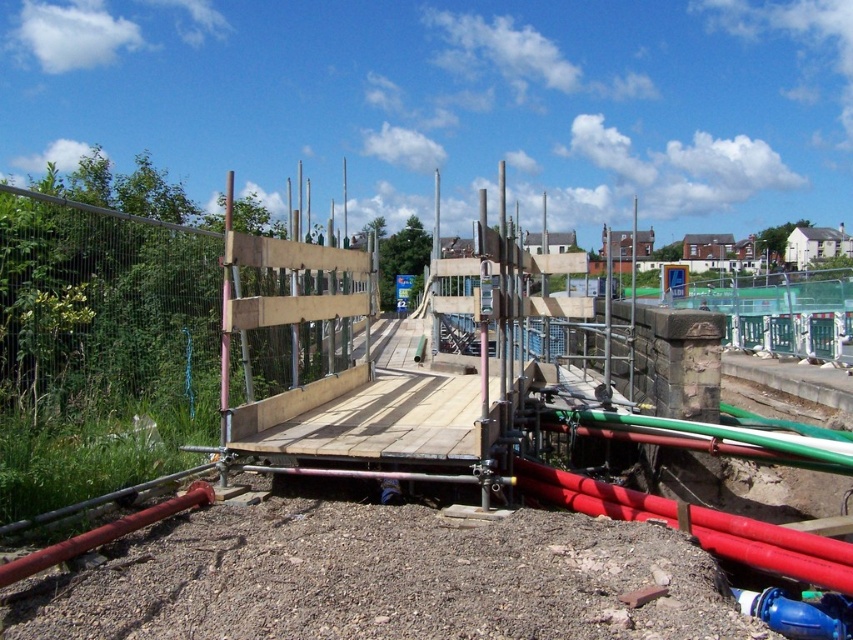
Question: Among these points, which one is farthest from the camera?

Choices:
 (A) (239, 426)
 (B) (799, 634)

Answer: (A)

Question: Does wooden platform at center appear on the left side of blue rubber hose at lower right?

Choices:
 (A) yes
 (B) no

Answer: (A)

Question: In this image, where is wooden platform at center located relative to blue rubber hose at lower right?

Choices:
 (A) right
 (B) left

Answer: (B)

Question: Which point is farther from the camera taking this photo?

Choices:
 (A) (776, 612)
 (B) (743, 525)

Answer: (B)

Question: Considering the relative positions of wooden platform at center and blue rubber hose at lower right in the image provided, where is wooden platform at center located with respect to blue rubber hose at lower right?

Choices:
 (A) left
 (B) right

Answer: (A)